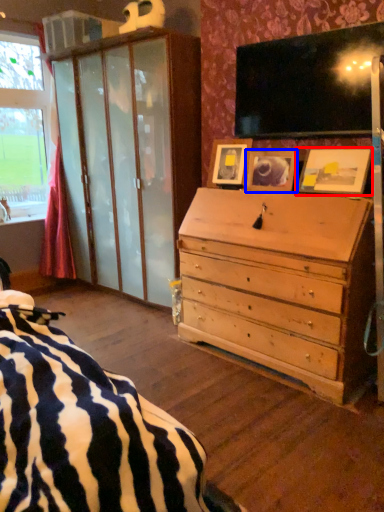
Question: Which object appears closest to the camera in this image, picture frame (highlighted by a red box) or picture frame (highlighted by a blue box)?

Choices:
 (A) picture frame
 (B) picture frame

Answer: (A)